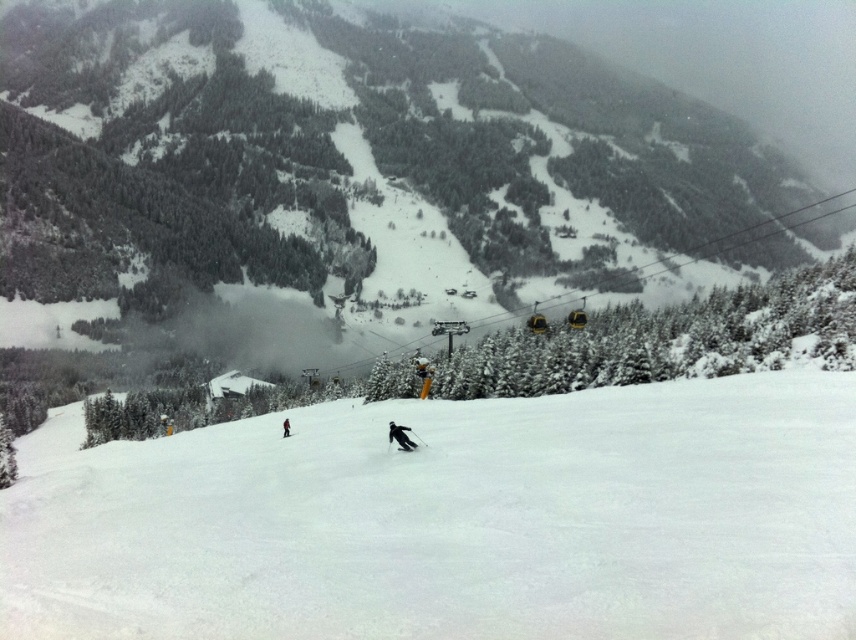
Looking at this image, you are a photographer trying to capture both the black matte skier at center and the red fabric jacket at center in a single frame. Based on their sizes in the image, which skier should you focus on to ensure both are clearly visible in your shot?

The black matte skier at center is shorter than the red fabric jacket at center, so focusing on the red fabric jacket at center would allow both to be visible as the larger subject can be centered while the smaller one fits into the frame.

You are a photographer trying to capture a clear photo of the red fabric jacket at center and the black matte ski at center. Since the ski lift cables are in the way, you need to move either left or right to avoid them. Which direction should you move to ensure both objects remain in the frame while avoiding the cables?

The red fabric jacket at center is wider than the black matte ski at center. To keep both in frame while avoiding the cables, move slightly to the right so the cables pass between them, maintaining visibility of both objects.

You are planning to place a small flag on the highest point between the white snow ski slope at center and the black matte ski at center. Which object should you choose to place the flag on?

The white snow ski slope at center has a greater height compared to the black matte ski at center, so you should place the flag on the white snow ski slope at center.